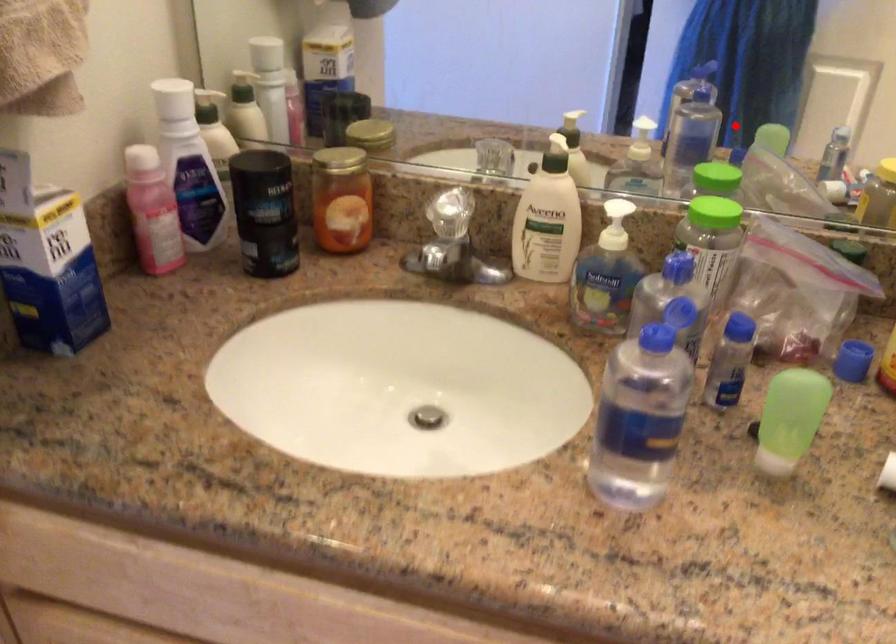
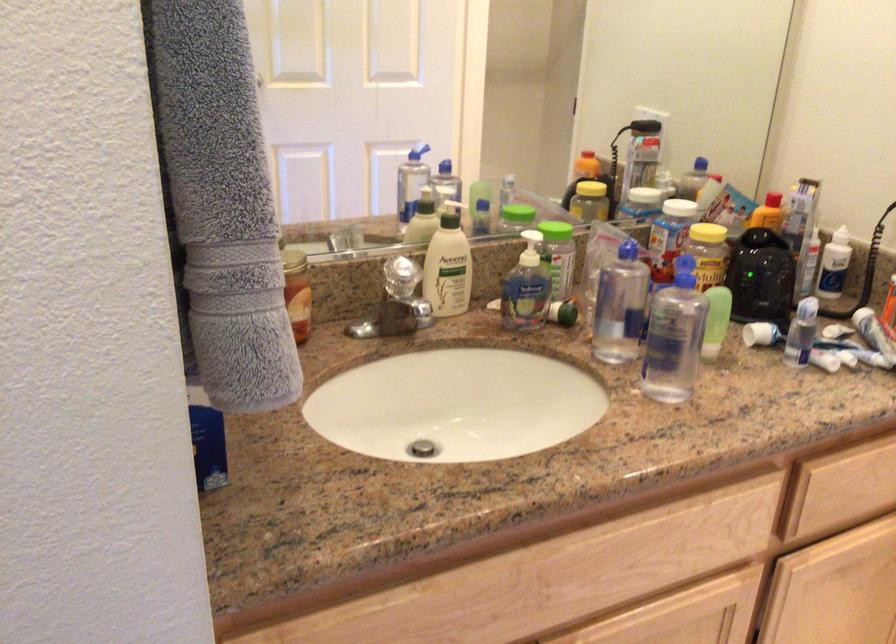
Question: I am providing you with two images of the same scene from different viewpoints. A red point is marked on the first image. Can you still see the location of the red point in image 2?

Choices:
 (A) Yes
 (B) No

Answer: (B)